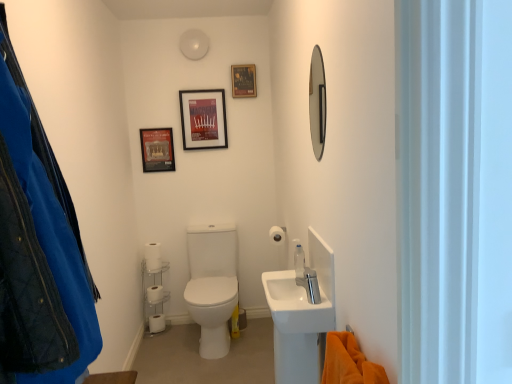
This screenshot has height=384, width=512. Find the location of `free region on the left part of satin nickel faucet at sink right`. free region on the left part of satin nickel faucet at sink right is located at coordinates (293, 295).